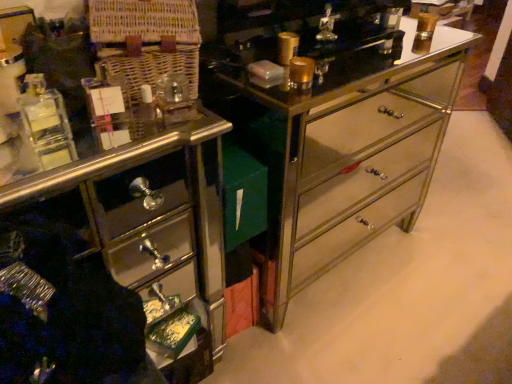
The width and height of the screenshot is (512, 384). I want to click on vacant space in metallic mirrored dresser at center (from a real-world perspective), so click(x=338, y=254).